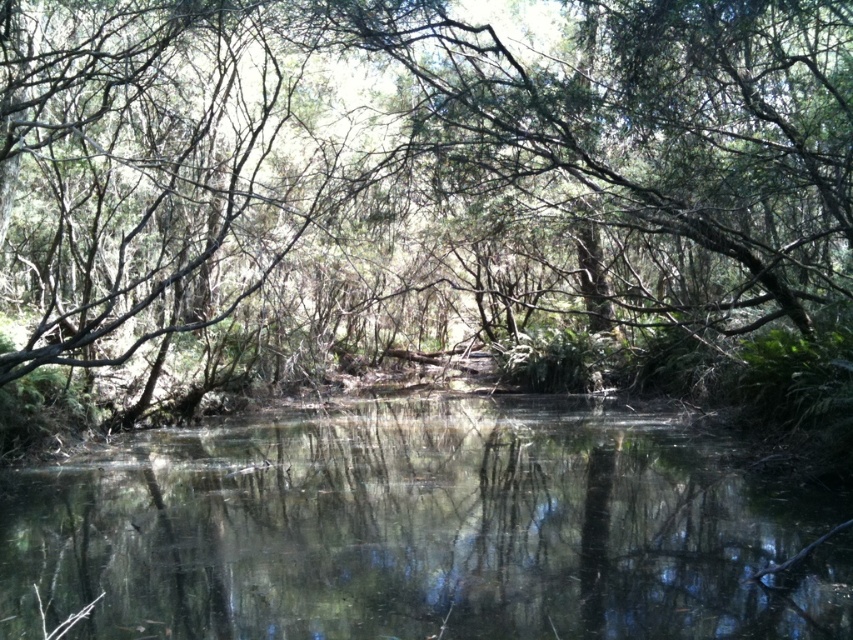
Question: In this image, where is green leafy tree at center located relative to clear water at center?

Choices:
 (A) right
 (B) left

Answer: (B)

Question: From the image, what is the correct spatial relationship of green leafy tree at center in relation to clear water at center?

Choices:
 (A) right
 (B) left

Answer: (B)

Question: Which point is farther from the camera taking this photo?

Choices:
 (A) (447, 212)
 (B) (523, 454)

Answer: (A)

Question: Which object is farther from the camera taking this photo?

Choices:
 (A) clear water at center
 (B) green leafy tree at center

Answer: (B)

Question: Observing the image, what is the correct spatial positioning of green leafy tree at center in reference to clear water at center?

Choices:
 (A) right
 (B) left

Answer: (B)

Question: Which point is closer to the camera?

Choices:
 (A) (74, 493)
 (B) (648, 186)

Answer: (A)